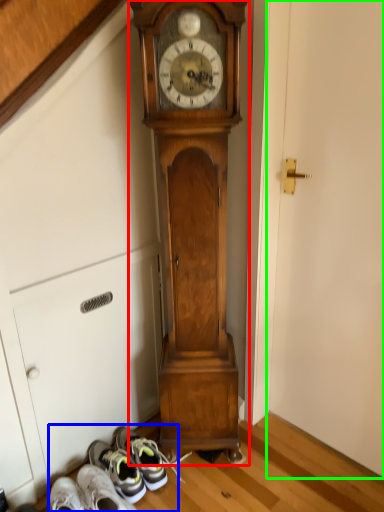
Question: Considering the real-world distances, which object is closest to wall clock (highlighted by a red box)? shoe (highlighted by a blue box) or door (highlighted by a green box).

Choices:
 (A) shoe
 (B) door

Answer: (B)